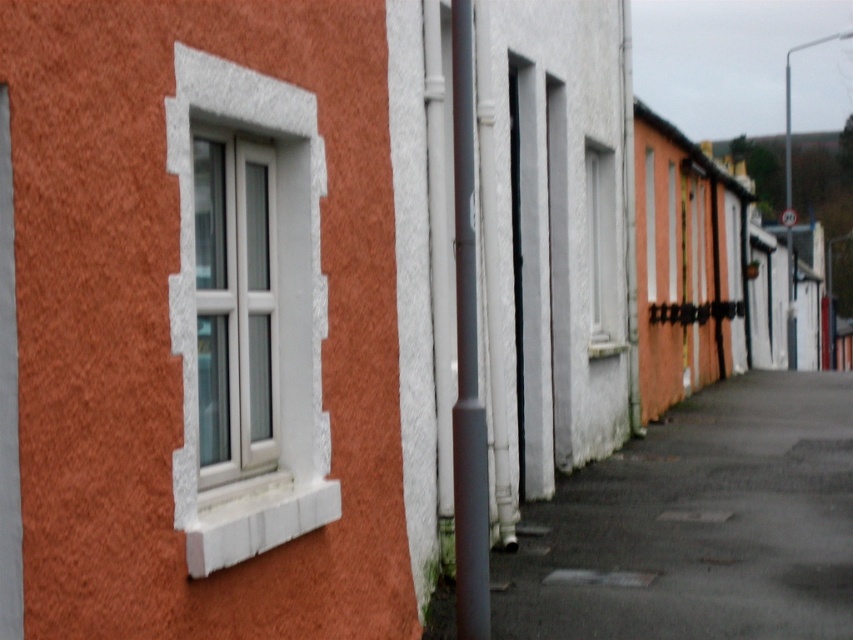
Can you confirm if dark asphalt at lower center is positioned above white plastic window at center?

No, dark asphalt at lower center is not above white plastic window at center.

Who is more forward, (434, 637) or (238, 204)?

Positioned in front is point (238, 204).

Find the location of a particular element. dark asphalt at lower center is located at coordinates (698, 524).

Which is below, dark asphalt at lower center or white textured window at center?

dark asphalt at lower center is lower down.

Does dark asphalt at lower center have a lesser width compared to white textured window at center?

No, dark asphalt at lower center is not thinner than white textured window at center.

Between point (788, 387) and point (602, 328), which one is positioned in front?

Positioned in front is point (602, 328).

This screenshot has width=853, height=640. Find the location of `dark asphalt at lower center`. dark asphalt at lower center is located at coordinates (698, 524).

Between dark asphalt at lower center and white stone window at left, which one is positioned lower?

dark asphalt at lower center

Who is shorter, dark asphalt at lower center or white stone window at left?

With less height is dark asphalt at lower center.

What do you see at coordinates (698, 524) in the screenshot?
I see `dark asphalt at lower center` at bounding box center [698, 524].

The image size is (853, 640). Find the location of `dark asphalt at lower center`. dark asphalt at lower center is located at coordinates (698, 524).